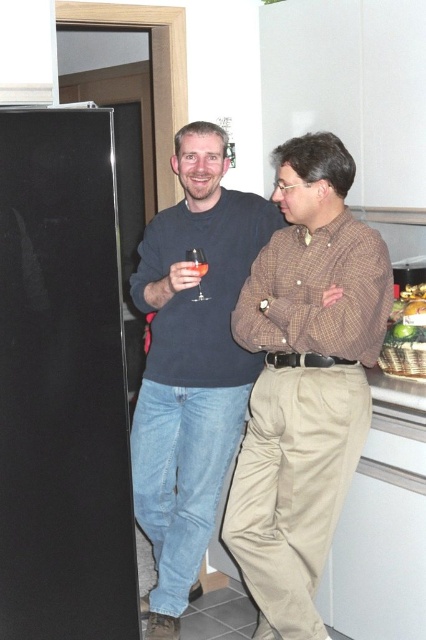
Question: Which object is positioned closest to the brown checkered shirt at center?

Choices:
 (A) dark blue sweater at center
 (B) transparent glass at left
 (C) black glossy refrigerator at left
 (D) translucent glass wine at center

Answer: (A)

Question: Which point is closer to the camera?

Choices:
 (A) pos(92,301)
 (B) pos(189,269)
 (C) pos(201,300)
 (D) pos(261,436)

Answer: (A)

Question: Considering the relative positions of transparent glass at left and translucent glass wine at center in the image provided, where is transparent glass at left located with respect to translucent glass wine at center?

Choices:
 (A) right
 (B) left

Answer: (A)

Question: Is brown checkered shirt at center further to camera compared to translucent glass wine at center?

Choices:
 (A) no
 (B) yes

Answer: (A)

Question: Among these objects, which one is farthest from the camera?

Choices:
 (A) brown checkered shirt at center
 (B) translucent glass wine at center
 (C) dark blue sweater at center
 (D) transparent glass at left

Answer: (C)

Question: Does black glossy refrigerator at left appear over transparent glass at left?

Choices:
 (A) no
 (B) yes

Answer: (A)